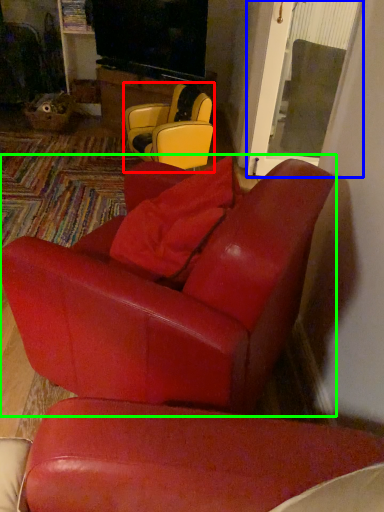
Question: Based on their relative distances, which object is nearer to chair (highlighted by a red box)? Choose from glass door (highlighted by a blue box) and chair (highlighted by a green box).

Choices:
 (A) glass door
 (B) chair

Answer: (A)